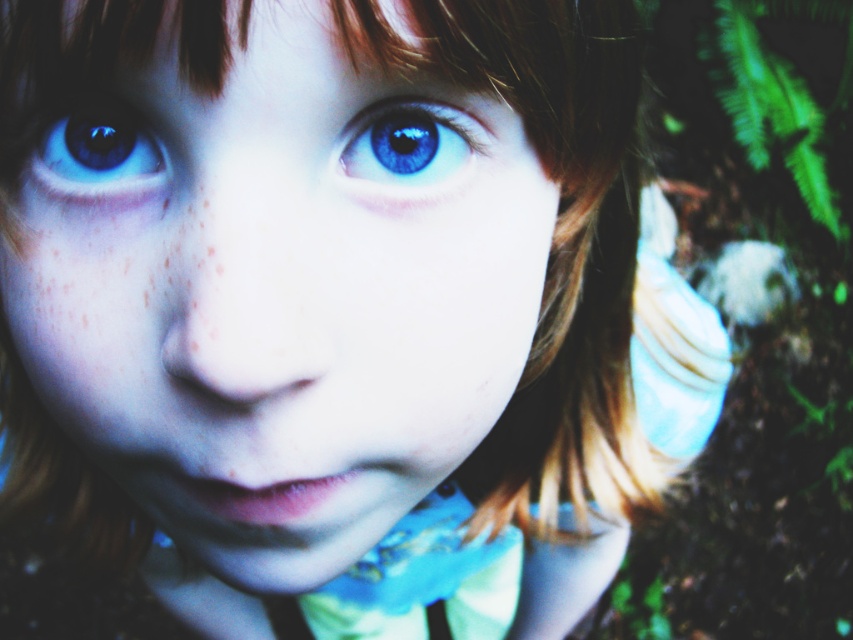
Question: Is blue glossy eye at upper center bigger than blue glossy eye at upper left?

Choices:
 (A) yes
 (B) no

Answer: (A)

Question: Does smooth skin face at center come in front of blue glossy eye at upper center?

Choices:
 (A) no
 (B) yes

Answer: (B)

Question: Estimate the real-world distances between objects in this image. Which object is farther from the blue glossy eye at upper left?

Choices:
 (A) blue glossy eye at upper center
 (B) smooth skin face at center

Answer: (A)

Question: Which object is the farthest from the blue glossy eye at upper left?

Choices:
 (A) blue glossy eye at upper center
 (B) smooth skin face at center

Answer: (A)

Question: From the image, what is the correct spatial relationship of blue glossy eye at upper center in relation to blue glossy eye at upper left?

Choices:
 (A) left
 (B) right

Answer: (B)

Question: Which point appears farthest from the camera in this image?

Choices:
 (A) (386, 288)
 (B) (78, 113)
 (C) (364, 144)

Answer: (B)